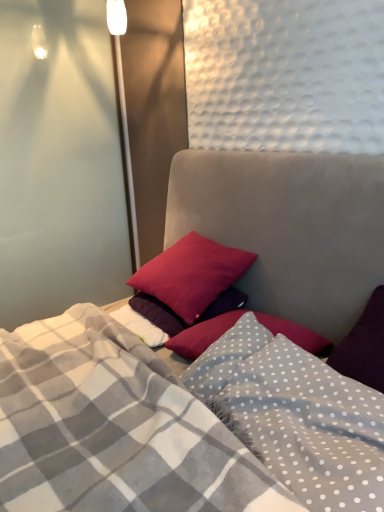
Measure the distance between transparent glass door at left and camera.

2.00 meters.

The height and width of the screenshot is (512, 384). Identify the location of velvet-like pillows at center. (148, 428).

Find the location of `gray polka dot blanket at center`. gray polka dot blanket at center is located at coordinates (309, 425).

Image resolution: width=384 pixels, height=512 pixels. Find the location of `pillow above the matte red pillow at center, acting as the 1th pillow starting from the bottom (from the image's perspective)`. pillow above the matte red pillow at center, acting as the 1th pillow starting from the bottom (from the image's perspective) is located at coordinates (191, 274).

Considering the sizes of matte red pillow at center, acting as the 1th pillow starting from the bottom, and matte red pillow at center, which is the 1th pillow from top to bottom, in the image, is matte red pillow at center, acting as the 1th pillow starting from the bottom, wider or thinner than matte red pillow at center, which is the 1th pillow from top to bottom,?

matte red pillow at center, acting as the 1th pillow starting from the bottom, is thinner than matte red pillow at center, which is the 1th pillow from top to bottom.

Can you tell me how much matte red pillow at center, acting as the second pillow starting from the top, and matte red pillow at center, which is the 1th pillow from top to bottom, differ in facing direction?

The angle between the facing direction of matte red pillow at center, acting as the second pillow starting from the top, and the facing direction of matte red pillow at center, which is the 1th pillow from top to bottom, is 1.27 degrees.

From the image's perspective, is matte red pillow at center, acting as the second pillow starting from the top, above matte red pillow at center, which is the 1th pillow from top to bottom?

No, from the image's perspective, matte red pillow at center, acting as the second pillow starting from the top, is not above matte red pillow at center, which is the 1th pillow from top to bottom.

Can you confirm if velvet-like pillows at center is taller than matte red pillow at center, acting as the 1th pillow starting from the bottom?

Correct, velvet-like pillows at center is much taller as matte red pillow at center, acting as the 1th pillow starting from the bottom.

Is there a large distance between velvet-like pillows at center and matte red pillow at center, acting as the second pillow starting from the top?

Actually, velvet-like pillows at center and matte red pillow at center, acting as the second pillow starting from the top, are a little close together.

Is velvet-like pillows at center wider or thinner than matte red pillow at center, acting as the second pillow starting from the top?

Considering their sizes, velvet-like pillows at center looks broader than matte red pillow at center, acting as the second pillow starting from the top.

Considering the positions of points (118, 485) and (143, 300), is point (118, 485) farther from camera compared to point (143, 300)?

No, (118, 485) is closer to viewer.

Is matte red pillow at center, arranged as the second pillow when ordered from the bottom, closer to camera compared to matte red pillow at center, acting as the second pillow starting from the top?

Yes, the depth of matte red pillow at center, arranged as the second pillow when ordered from the bottom, is less than that of matte red pillow at center, acting as the second pillow starting from the top.

What's the angular difference between matte red pillow at center, arranged as the second pillow when ordered from the bottom, and matte red pillow at center, acting as the 1th pillow starting from the bottom,'s facing directions?

There is a 1.27-degree angle between the facing directions of matte red pillow at center, arranged as the second pillow when ordered from the bottom, and matte red pillow at center, acting as the 1th pillow starting from the bottom.

From the image's perspective, is matte red pillow at center, arranged as the second pillow when ordered from the bottom, positioned above or below matte red pillow at center, acting as the second pillow starting from the top?

From the image's perspective, matte red pillow at center, arranged as the second pillow when ordered from the bottom, appears above matte red pillow at center, acting as the second pillow starting from the top.

Is matte red pillow at center, which is the 1th pillow from top to bottom, aimed at matte red pillow at center, acting as the second pillow starting from the top?

No.

Would you consider gray polka dot blanket at center to be distant from matte red pillow at center, acting as the second pillow starting from the top?

No, gray polka dot blanket at center is not far from matte red pillow at center, acting as the second pillow starting from the top.

From the image's perspective, is gray polka dot blanket at center under matte red pillow at center, acting as the 1th pillow starting from the bottom?

Yes.

Is gray polka dot blanket at center inside the boundaries of matte red pillow at center, acting as the 1th pillow starting from the bottom, or outside?

gray polka dot blanket at center is spatially situated outside matte red pillow at center, acting as the 1th pillow starting from the bottom.

From a real-world perspective, is gray polka dot blanket at center physically below matte red pillow at center, acting as the 1th pillow starting from the bottom?

Incorrect, from a real-world perspective, gray polka dot blanket at center is higher than matte red pillow at center, acting as the 1th pillow starting from the bottom.

Are transparent glass door at left and velvet-like pillows at center beside each other?

transparent glass door at left and velvet-like pillows at center are clearly separated.

Considering the sizes of transparent glass door at left and velvet-like pillows at center in the image, is transparent glass door at left taller or shorter than velvet-like pillows at center?

transparent glass door at left is taller than velvet-like pillows at center.

Is velvet-like pillows at center located within transparent glass door at left?

No, velvet-like pillows at center is located outside of transparent glass door at left.

How distant is transparent glass door at left from velvet-like pillows at center?

The distance of transparent glass door at left from velvet-like pillows at center is 1.16 meters.

Is velvet-like pillows at center positioned beyond the bounds of gray polka dot blanket at center?

Indeed, velvet-like pillows at center is completely outside gray polka dot blanket at center.

Would you say velvet-like pillows at center is a long distance from gray polka dot blanket at center?

velvet-like pillows at center is near gray polka dot blanket at center, not far away.

From a real-world perspective, is velvet-like pillows at center above or below gray polka dot blanket at center?

From a real-world perspective, velvet-like pillows at center is physically above gray polka dot blanket at center.

You are a GUI agent. You are given a task and a screenshot of the screen. Output one action in this format:
    pyautogui.click(x=<x>, y=<y>)
    Task: Click on the bed above the gray polka dot blanket at center (from a real-world perspective)
    
    Given the screenshot: What is the action you would take?
    pyautogui.click(x=148, y=428)

What's the angular difference between matte red pillow at center, acting as the second pillow starting from the top, and gray polka dot blanket at center's facing directions?

They differ by 4.45 degrees in their facing directions.

From a real-world perspective, which object rests below the other?

In real-world perspective, matte red pillow at center, acting as the 1th pillow starting from the bottom, is lower.

Between matte red pillow at center, acting as the 1th pillow starting from the bottom, and gray polka dot blanket at center, which one appears on the left side from the viewer's perspective?

From the viewer's perspective, matte red pillow at center, acting as the 1th pillow starting from the bottom, appears more on the left side.

I want to click on pillow that appears above the matte red pillow at center, acting as the second pillow starting from the top (from a real-world perspective), so click(x=191, y=274).

The height and width of the screenshot is (512, 384). Find the location of `the 1st pillow above the velvet-like pillows at center (from the image's perspective)`. the 1st pillow above the velvet-like pillows at center (from the image's perspective) is located at coordinates (157, 313).

Considering their positions, is matte red pillow at center, acting as the second pillow starting from the top, positioned closer to velvet-like pillows at center than matte red pillow at center, which is the 1th pillow from top to bottom?

matte red pillow at center, acting as the second pillow starting from the top.

Based on their spatial positions, is velvet-like pillows at center or transparent glass door at left closer to matte red pillow at center, acting as the second pillow starting from the top?

Among the two, velvet-like pillows at center is located nearer to matte red pillow at center, acting as the second pillow starting from the top.

From the image, which object appears to be farther from matte red pillow at center, acting as the 1th pillow starting from the bottom, matte red pillow at center, arranged as the second pillow when ordered from the bottom, or gray polka dot blanket at center?

The object further to matte red pillow at center, acting as the 1th pillow starting from the bottom, is gray polka dot blanket at center.

From the image, which object appears to be farther from velvet-like pillows at center, matte red pillow at center, which is the 1th pillow from top to bottom, or transparent glass door at left?

Among the two, transparent glass door at left is located further to velvet-like pillows at center.

Based on their spatial positions, is matte red pillow at center, acting as the 1th pillow starting from the bottom, or velvet-like pillows at center further from gray polka dot blanket at center?

Among the two, matte red pillow at center, acting as the 1th pillow starting from the bottom, is located further to gray polka dot blanket at center.

Estimate the real-world distances between objects in this image. Which object is further from matte red pillow at center, which is the 1th pillow from top to bottom, matte red pillow at center, acting as the 1th pillow starting from the bottom, or gray polka dot blanket at center?

gray polka dot blanket at center is positioned further to the anchor matte red pillow at center, which is the 1th pillow from top to bottom.

From the image, which object appears to be nearer to matte red pillow at center, acting as the second pillow starting from the top, transparent glass door at left or matte red pillow at center, which is the 1th pillow from top to bottom?

matte red pillow at center, which is the 1th pillow from top to bottom, is positioned closer to the anchor matte red pillow at center, acting as the second pillow starting from the top.

Which object lies further to the anchor point matte red pillow at center, acting as the second pillow starting from the top, velvet-like pillows at center or gray polka dot blanket at center?

gray polka dot blanket at center.

The height and width of the screenshot is (512, 384). What are the coordinates of `blanket between velvet-like pillows at center and matte red pillow at center, acting as the second pillow starting from the top, in the front-back direction` in the screenshot? It's located at (309, 425).

Locate an element on the screen. Image resolution: width=384 pixels, height=512 pixels. pillow between transparent glass door at left and matte red pillow at center, which is the 1th pillow from top to bottom is located at coordinates (157, 313).

In order to click on blanket between velvet-like pillows at center and transparent glass door at left along the z-axis in this screenshot , I will do pyautogui.click(x=309, y=425).

Identify the location of blanket positioned between velvet-like pillows at center and matte red pillow at center, which is the 1th pillow from top to bottom, from near to far. This screenshot has height=512, width=384. pyautogui.click(x=309, y=425).